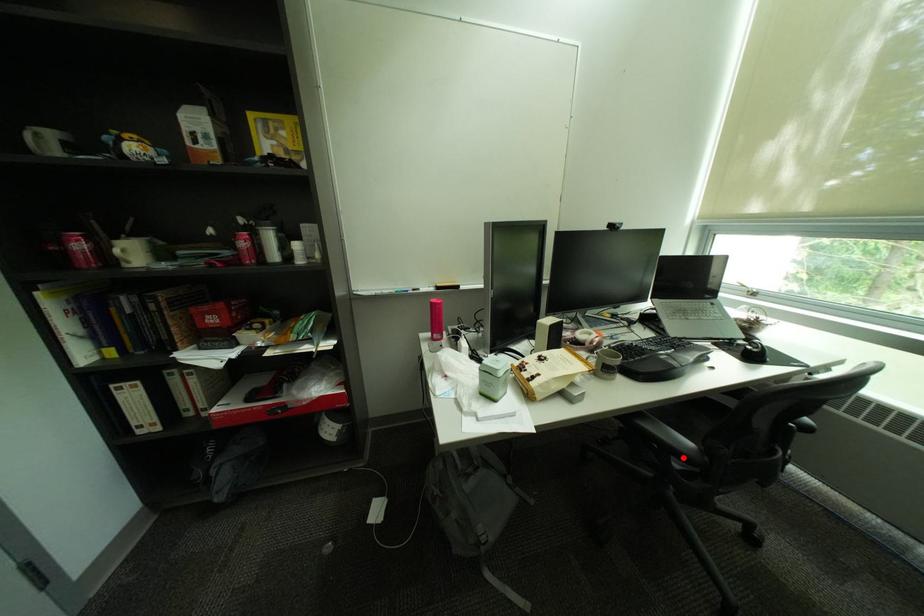
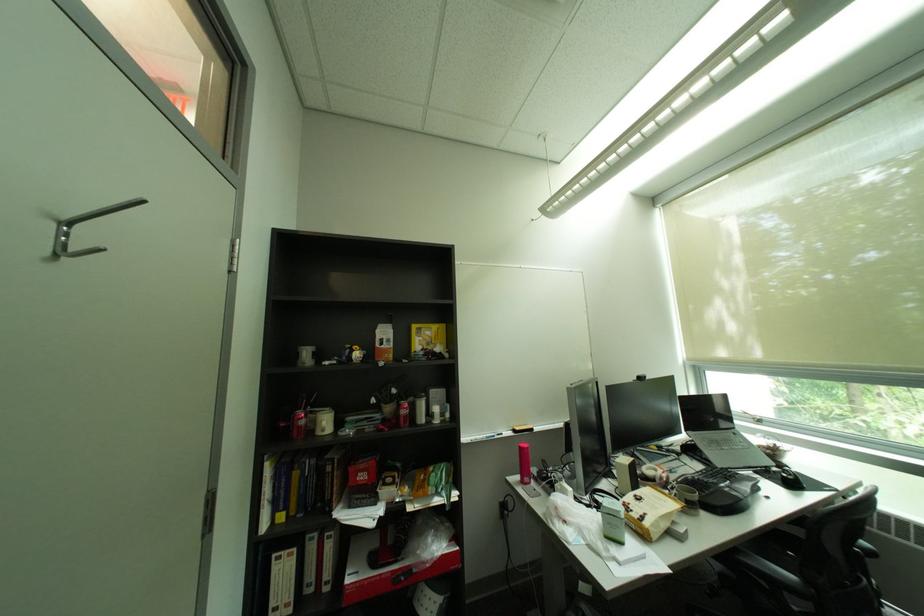
Where in the second image is the point corresponding to the highlighted location from the first image?

(796, 594)